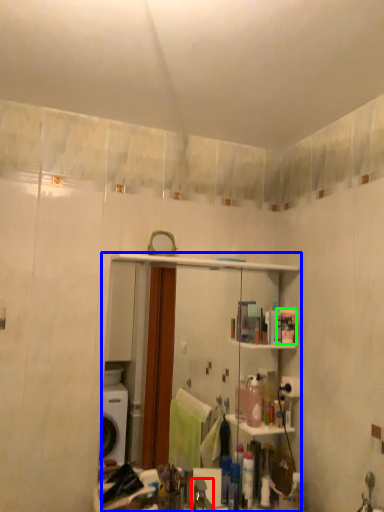
Question: Based on their relative distances, which object is nearer to faucet (highlighted by a red box)? Choose from mirror (highlighted by a blue box) and toiletry (highlighted by a green box).

Choices:
 (A) mirror
 (B) toiletry

Answer: (B)